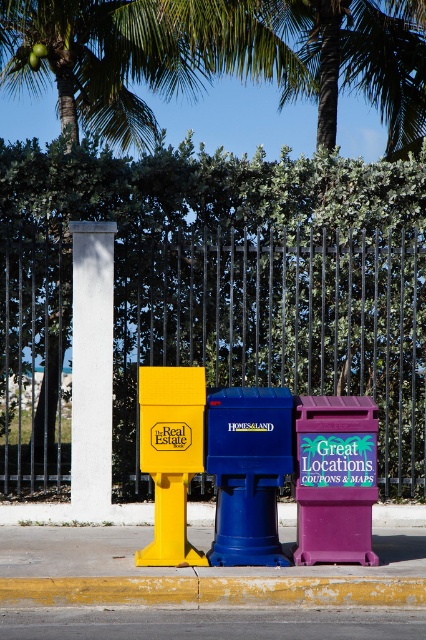
You are standing on the sidewalk and want to place a small potted plant between the gray asphalt at lower center and the purple matte recycling bin at center. Which object should the plant be closer to if you want it to be nearer to the viewer?

The plant should be placed closer to the gray asphalt at lower center because it is already closer to the viewer than the purple matte recycling bin at center.

You are a delivery person carrying a large package that requires placing on a surface. Which object between the gray asphalt at lower center and the purple matte recycling bin at center can support the package?

The purple matte recycling bin at center has a larger size than the gray asphalt at lower center, so it can support the package better.

You are a delivery person trying to place a large package on the sidewalk. The yellow painted concrete curb at lower center and the matte yellow real estate box at center are in your way. Which object should you move to make more space?

The yellow painted concrete curb at lower center has a smaller size compared to matte yellow real estate box at center, so you should move the matte yellow real estate box at center to create more space since it takes up more area.